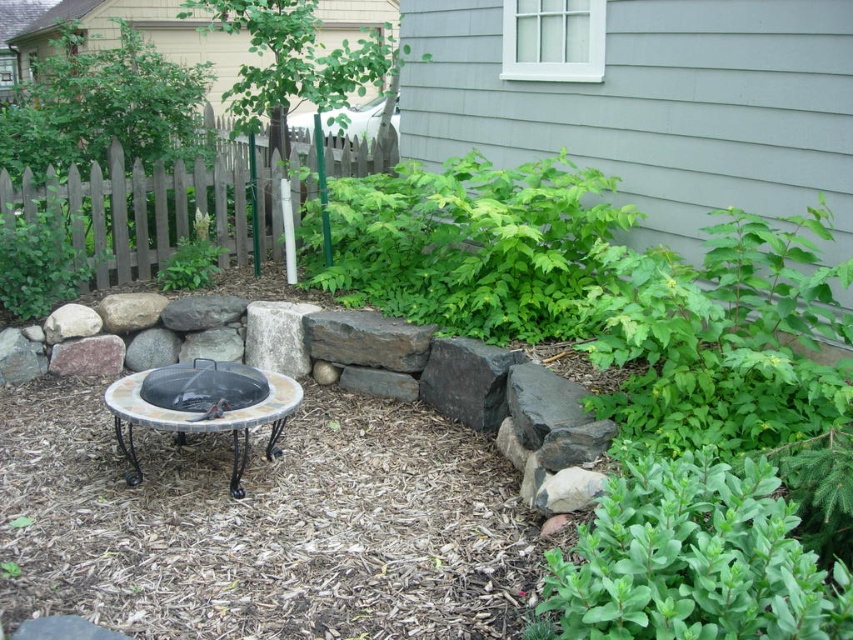
Measure the distance between green leafy plant at lower right and green leafy plant at left.

A distance of 12.89 feet exists between green leafy plant at lower right and green leafy plant at left.

Locate an element on the screen. This screenshot has width=853, height=640. green leafy plant at lower right is located at coordinates (694, 557).

Locate an element on the screen. green leafy plant at lower right is located at coordinates (694, 557).

Can you confirm if green leafy bush at center is bigger than black mesh fire pit at center?

→ Yes.

Between green leafy bush at center and black mesh fire pit at center, which one is positioned lower?

black mesh fire pit at center

What do you see at coordinates (469, 246) in the screenshot?
I see `green leafy bush at center` at bounding box center [469, 246].

Find the location of a particular element. green leafy bush at center is located at coordinates (469, 246).

Does gray wood fence at upper left come behind gray rough stone at center?

Yes, gray wood fence at upper left is further from the viewer.

Can you confirm if gray wood fence at upper left is positioned to the right of gray rough stone at center?

No, gray wood fence at upper left is not to the right of gray rough stone at center.

Where is `gray wood fence at upper left`? This screenshot has height=640, width=853. gray wood fence at upper left is located at coordinates (158, 209).